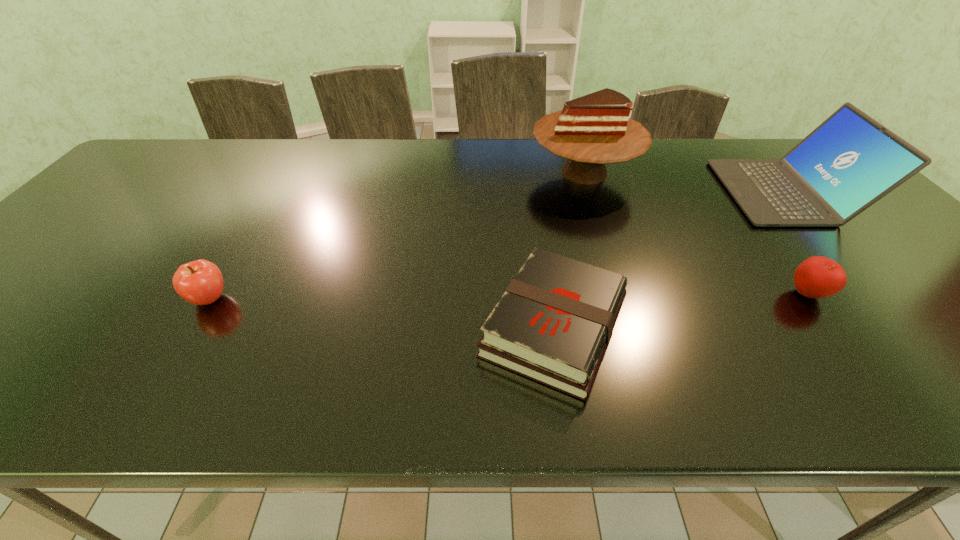
Locate an element on the screen. The image size is (960, 540). cake is located at coordinates (593, 130).

Identify the location of laptop computer. The height and width of the screenshot is (540, 960). (850, 161).

The height and width of the screenshot is (540, 960). I want to click on the left apple, so click(x=200, y=282).

Where is `the right apple`? The image size is (960, 540). the right apple is located at coordinates (817, 277).

Locate an element on the screen. The image size is (960, 540). the shorter apple is located at coordinates (817, 277).

Where is `the shortest object`? The height and width of the screenshot is (540, 960). the shortest object is located at coordinates (553, 324).

Locate an element on the screen. The height and width of the screenshot is (540, 960). blank space located on the front of the cake is located at coordinates (613, 261).

Locate an element on the screen. free spot located on the screen of the laptop computer is located at coordinates (685, 192).

Identify the location of vacant space situated on the screen of the laptop computer. (635, 192).

You are a GUI agent. You are given a task and a screenshot of the screen. Output one action in this format:
    pyautogui.click(x=<x>, y=<y>)
    Task: Click on the free space located on the screen of the laptop computer
    
    Given the screenshot: What is the action you would take?
    pyautogui.click(x=696, y=192)